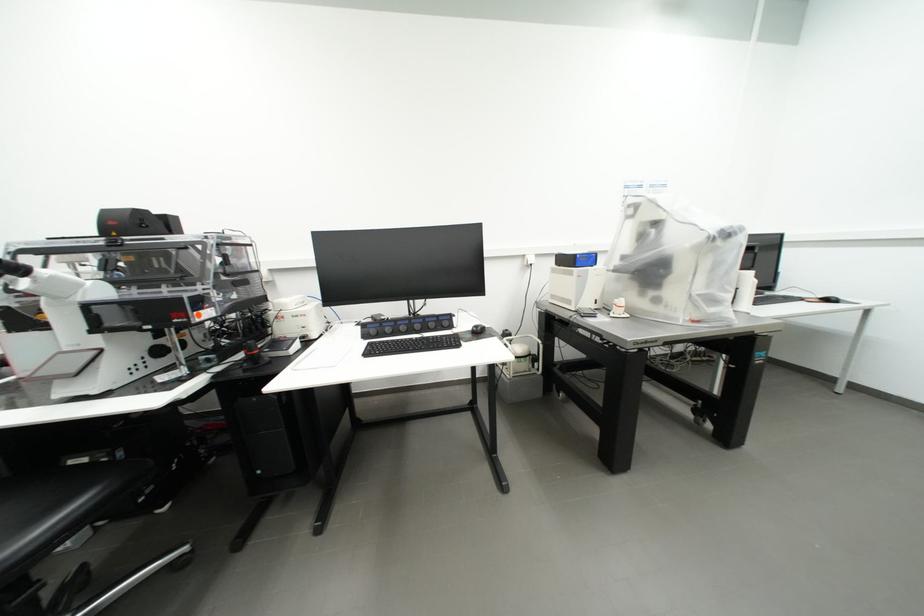
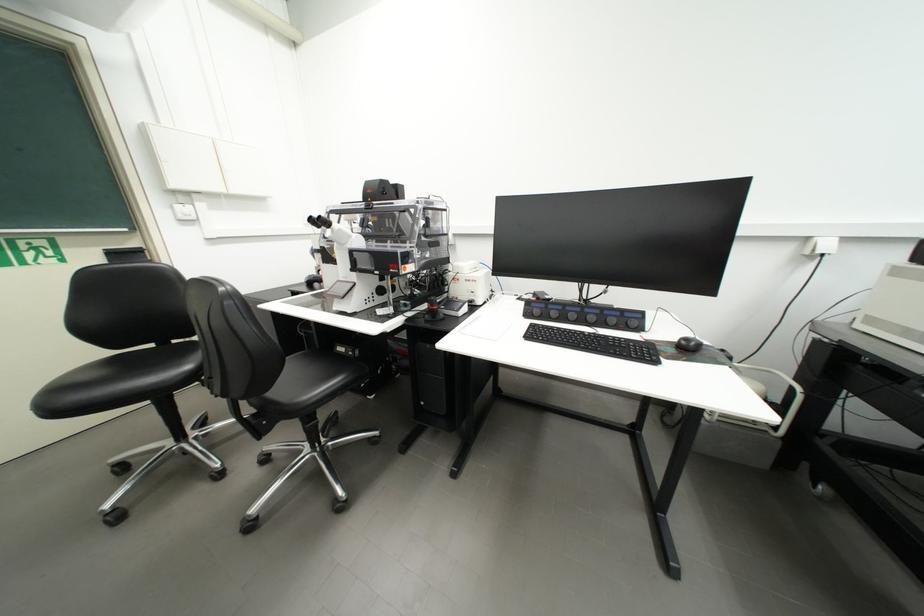
Locate, in the second image, the point that corresponds to pixel 487 334 in the first image.

(697, 351)